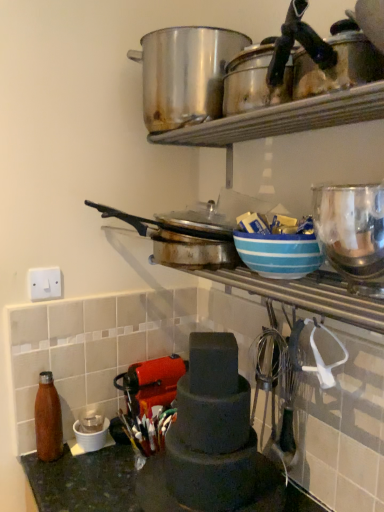
Image resolution: width=384 pixels, height=512 pixels. I want to click on blue striped bowl at upper center, so click(279, 253).

The width and height of the screenshot is (384, 512). What do you see at coordinates (44, 283) in the screenshot?
I see `white plastic switch at upper left` at bounding box center [44, 283].

In order to face stainless steel pot at upper center, should I rotate leftwards or rightwards?

To face it directly, rotate left by 4.160 degrees.

Where is `matte black tiered cake stand at center, arranged as the second appliance when viewed from the front`? This screenshot has height=512, width=384. matte black tiered cake stand at center, arranged as the second appliance when viewed from the front is located at coordinates (212, 429).

What are the coordinates of `shiny metallic pots at upper right, which is counted as the second appliance, starting from the bottom` in the screenshot? It's located at (338, 63).

You are a GUI agent. You are given a task and a screenshot of the screen. Output one action in this format:
    pyautogui.click(x=<x>, y=<y>)
    Task: Click on the matte brown bottle at lower left
    This screenshot has height=512, width=384.
    Given the screenshot: What is the action you would take?
    pyautogui.click(x=93, y=348)

Measure the distance between point (x=104, y=380) and camera.

The depth of point (x=104, y=380) is 4.37 feet.

Identify the location of blue striped bowl at upper center. The width and height of the screenshot is (384, 512). (279, 253).

Is white plastic switch at upper left not within shiny metallic bottle at lower left?

Yes.

Is white plastic switch at upper left next to shiny metallic bottle at lower left?

No, white plastic switch at upper left is not next to shiny metallic bottle at lower left.

Considering the relative sizes of white plastic switch at upper left and shiny metallic bottle at lower left in the image provided, is white plastic switch at upper left shorter than shiny metallic bottle at lower left?

Indeed, white plastic switch at upper left has a lesser height compared to shiny metallic bottle at lower left.

Based on their sizes in the image, would you say blue striped bowl at upper center is bigger or smaller than dark green stone countertop at lower left?

Clearly, blue striped bowl at upper center is smaller in size than dark green stone countertop at lower left.

Between blue striped bowl at upper center and dark green stone countertop at lower left, which one appears on the left side from the viewer's perspective?

dark green stone countertop at lower left is more to the left.

From the image's perspective, would you say blue striped bowl at upper center is positioned over dark green stone countertop at lower left?

Yes.

Measure the distance from blue striped bowl at upper center to dark green stone countertop at lower left.

blue striped bowl at upper center is 59.79 centimeters away from dark green stone countertop at lower left.

Identify the location of appliance in front of the blue striped bowl at upper center. (338, 63).

Which is in front, shiny metallic pots at upper right, which ranks as the first appliance in front-to-back order, or blue striped bowl at upper center?

shiny metallic pots at upper right, which ranks as the first appliance in front-to-back order.

Between point (338, 49) and point (272, 265), which one is positioned behind?

The point (272, 265) is farther from the camera.

From the picture: Is shiny metallic pots at upper right, which ranks as the first appliance in front-to-back order, shorter than blue striped bowl at upper center?

Yes, shiny metallic pots at upper right, which ranks as the first appliance in front-to-back order, is shorter than blue striped bowl at upper center.

I want to click on the 2nd appliance located beneath the stainless steel pot at upper center (from a real-world perspective), so click(x=212, y=429).

From a real-world perspective, is matte black tiered cake stand at center, the 1th appliance in the back-to-front sequence, positioned above or below stainless steel pot at upper center?

matte black tiered cake stand at center, the 1th appliance in the back-to-front sequence, is below stainless steel pot at upper center.

Based on their positions, is matte black tiered cake stand at center, the 1th appliance in the back-to-front sequence, located to the left or right of stainless steel pot at upper center?

In the image, matte black tiered cake stand at center, the 1th appliance in the back-to-front sequence, appears on the right side of stainless steel pot at upper center.

From the image's perspective, which one is positioned lower, matte black tiered cake stand at center, the second appliance from the top, or stainless steel pot at upper center?

matte black tiered cake stand at center, the second appliance from the top, is shown below in the image.

Considering the positions of objects white plastic switch at upper left and stainless steel pot at upper center in the image provided, who is more to the right, white plastic switch at upper left or stainless steel pot at upper center?

stainless steel pot at upper center is more to the right.

Can you confirm if white plastic switch at upper left is taller than stainless steel pot at upper center?

Incorrect, the height of white plastic switch at upper left is not larger of that of stainless steel pot at upper center.

Is stainless steel pot at upper center at the back of white plastic switch at upper left?

No, white plastic switch at upper left is not facing away from stainless steel pot at upper center.

Find the location of a particular element. This screenshot has width=384, height=512. crock pot on the right of white plastic switch at upper left is located at coordinates (185, 74).

Who is shorter, stainless steel pot at upper center or shiny metallic bottle at lower left?

Standing shorter between the two is shiny metallic bottle at lower left.

Is point (201, 66) positioned after point (49, 444)?

No, (201, 66) is in front of (49, 444).

Considering the sizes of objects stainless steel pot at upper center and shiny metallic bottle at lower left in the image provided, who is wider, stainless steel pot at upper center or shiny metallic bottle at lower left?

With larger width is stainless steel pot at upper center.

Considering the positions of objects stainless steel pot at upper center and shiny metallic bottle at lower left in the image provided, who is more to the right, stainless steel pot at upper center or shiny metallic bottle at lower left?

stainless steel pot at upper center.

Looking at this image, which object is further away from the camera, dark green stone countertop at lower left or matte black tiered cake stand at center, the second appliance from the top?

dark green stone countertop at lower left.

Considering the sizes of dark green stone countertop at lower left and matte black tiered cake stand at center, the 1th appliance in the back-to-front sequence, in the image, is dark green stone countertop at lower left taller or shorter than matte black tiered cake stand at center, the 1th appliance in the back-to-front sequence,?

dark green stone countertop at lower left is taller than matte black tiered cake stand at center, the 1th appliance in the back-to-front sequence.

Visually, is dark green stone countertop at lower left positioned to the left or to the right of matte black tiered cake stand at center, placed as the first appliance when sorted from bottom to top?

In the image, dark green stone countertop at lower left appears on the left side of matte black tiered cake stand at center, placed as the first appliance when sorted from bottom to top.

Does point (132, 481) come farther from viewer compared to point (195, 418)?

Yes, it is.

I want to click on electric outlet behind the shiny metallic bottle at lower left, so click(44, 283).

Where is `countertop that is under the blue striped bowl at upper center (from a real-world perspective)`? The image size is (384, 512). countertop that is under the blue striped bowl at upper center (from a real-world perspective) is located at coordinates (98, 482).

Looking at the image, which one is located closer to matte brown bottle at lower left, shiny metallic bottle at lower left or white plastic switch at upper left?

shiny metallic bottle at lower left is closer to matte brown bottle at lower left.

Based on their spatial positions, is matte black tiered cake stand at center, the second appliance from the top, or stainless steel pot at upper center further from matte brown bottle at lower left?

The object further to matte brown bottle at lower left is stainless steel pot at upper center.

When comparing their distances from shiny metallic pots at upper right, which ranks as the first appliance in front-to-back order, does dark green stone countertop at lower left or matte brown bottle at lower left seem further?

dark green stone countertop at lower left lies further to shiny metallic pots at upper right, which ranks as the first appliance in front-to-back order, than the other object.

In the scene shown: From the image, which object appears to be farther from white plastic switch at upper left, matte brown bottle at lower left or blue striped bowl at upper center?

Based on the image, blue striped bowl at upper center appears to be further to white plastic switch at upper left.

When comparing their distances from shiny metallic pots at upper right, acting as the 1th appliance starting from the top, does dark green stone countertop at lower left or matte black tiered cake stand at center, the second appliance from the top, seem further?

dark green stone countertop at lower left is positioned further to the anchor shiny metallic pots at upper right, acting as the 1th appliance starting from the top.

Estimate the real-world distances between objects in this image. Which object is further from dark green stone countertop at lower left, white plastic switch at upper left or matte brown bottle at lower left?

white plastic switch at upper left is further to dark green stone countertop at lower left.

From the image, which object appears to be farther from shiny metallic bottle at lower left, shiny metallic pots at upper right, which is counted as the second appliance, starting from the bottom, or matte brown bottle at lower left?

shiny metallic pots at upper right, which is counted as the second appliance, starting from the bottom, is further to shiny metallic bottle at lower left.

Which object lies further to the anchor point stainless steel pot at upper center, white plastic switch at upper left or dark green stone countertop at lower left?

dark green stone countertop at lower left is further to stainless steel pot at upper center.

Where is `bottle between stainless steel pot at upper center and dark green stone countertop at lower left in the up-down direction`? The height and width of the screenshot is (512, 384). bottle between stainless steel pot at upper center and dark green stone countertop at lower left in the up-down direction is located at coordinates point(48,419).

Where is `bowl between stainless steel pot at upper center and matte black tiered cake stand at center, placed as the first appliance when sorted from bottom to top, in the up-down direction`? bowl between stainless steel pot at upper center and matte black tiered cake stand at center, placed as the first appliance when sorted from bottom to top, in the up-down direction is located at coordinates (279, 253).

Locate an element on the screen. electric outlet that lies between shiny metallic pots at upper right, arranged as the 2th appliance when viewed from the back, and dark green stone countertop at lower left from top to bottom is located at coordinates (44, 283).

In order to click on tile between white plastic switch at upper left and matte black tiered cake stand at center, the second appliance from the top, from left to right in this screenshot , I will do `click(93, 348)`.